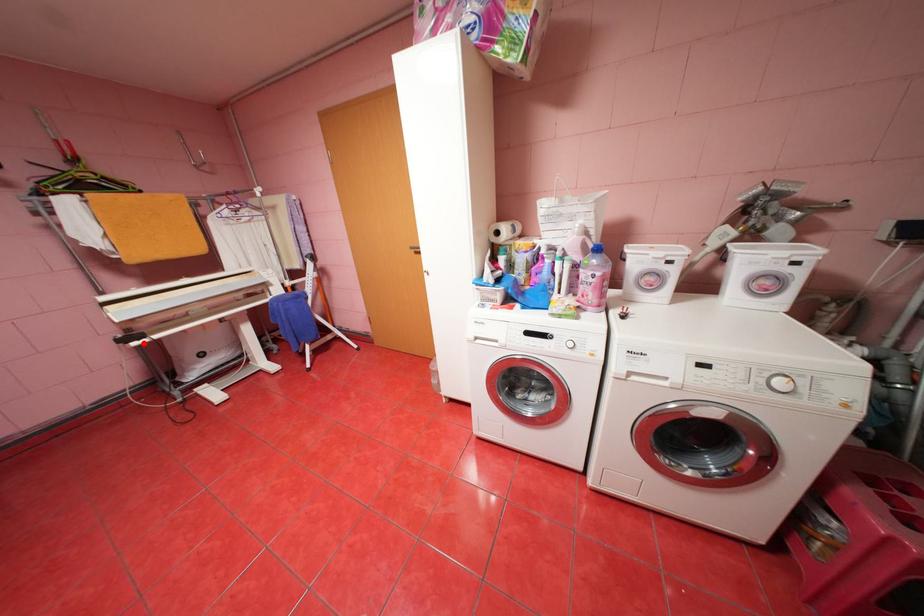
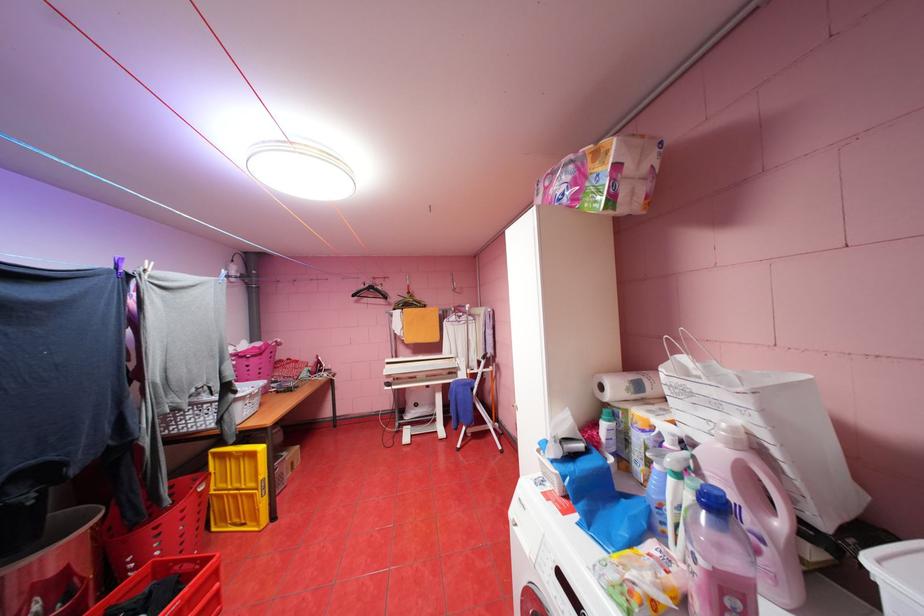
Where in the second image is the point corresponding to the highlighted location from the first image?

(395, 387)